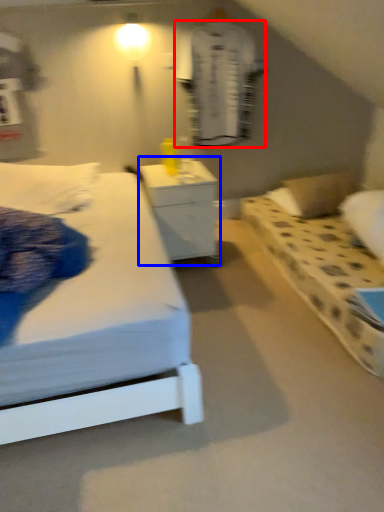
Question: Which object appears farthest to the camera in this image, robe (highlighted by a red box) or nightstand (highlighted by a blue box)?

Choices:
 (A) robe
 (B) nightstand

Answer: (A)